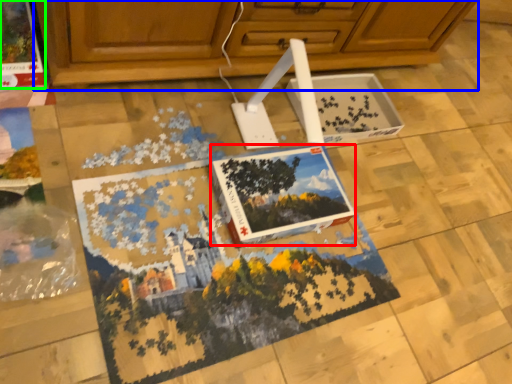
Question: Which object is the closest to the magazine (highlighted by a red box)? Choose among these: cabinetry (highlighted by a blue box) or magazine (highlighted by a green box).

Choices:
 (A) cabinetry
 (B) magazine

Answer: (A)